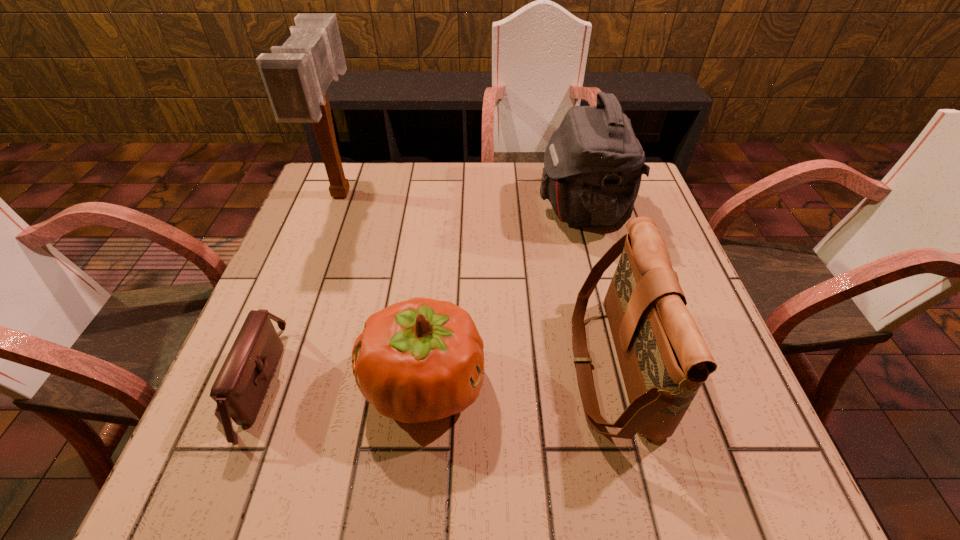
At what (x,y) coordinates should I click in order to perform the action: click on mallet. Please return your answer as a coordinate pair (x, y). The image size is (960, 540). Looking at the image, I should click on (296, 75).

Image resolution: width=960 pixels, height=540 pixels. Find the location of `the fourth shortest object`. the fourth shortest object is located at coordinates (593, 164).

You are a GUI agent. You are given a task and a screenshot of the screen. Output one action in this format:
    pyautogui.click(x=<x>, y=<y>)
    Task: Click on the tallest shoulder bag
    
    Given the screenshot: What is the action you would take?
    coord(593,164)

Identify the location of the third tallest object. (664, 360).

Locate an element on the screen. The image size is (960, 540). pumpkin is located at coordinates (420, 360).

The height and width of the screenshot is (540, 960). What are the coordinates of `the third object from left to right` in the screenshot? It's located at (420, 360).

Where is `the shortest shoulder bag`? The image size is (960, 540). the shortest shoulder bag is located at coordinates (239, 390).

In order to click on the shortest object in this screenshot , I will do coord(239,390).

Where is `free space located 0.280m on the right of the mallet`? free space located 0.280m on the right of the mallet is located at coordinates (459, 193).

Locate an element on the screen. The width and height of the screenshot is (960, 540). vacant point located on the open flap of the tallest shoulder bag is located at coordinates (451, 208).